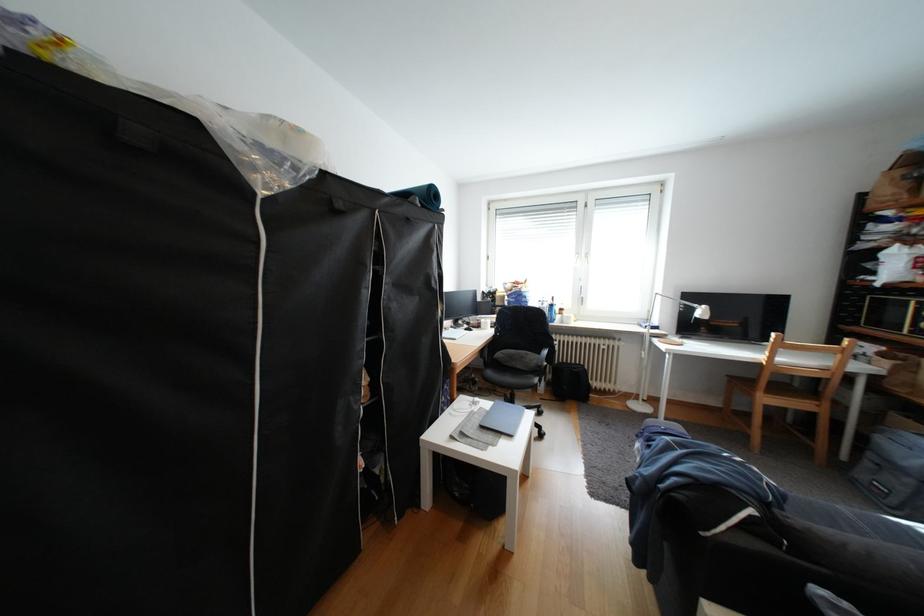
The height and width of the screenshot is (616, 924). Identify the location of black chair sitting surface. (494, 362).